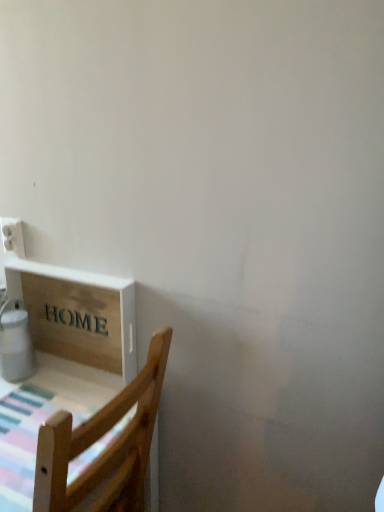
In order to click on vacant area that lies between wooden sign at lower left and white glossy water heater at lower left in this screenshot , I will do `click(56, 381)`.